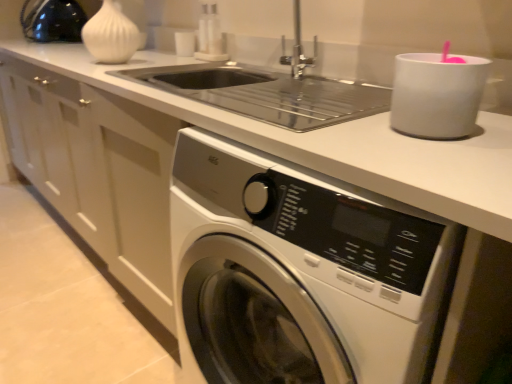
The width and height of the screenshot is (512, 384). What do you see at coordinates (300, 272) in the screenshot? I see `white glossy washing machine at lower center` at bounding box center [300, 272].

What do you see at coordinates (53, 21) in the screenshot? The image size is (512, 384). I see `matte black kettle at upper left, which ranks as the first appliance in left-to-right order` at bounding box center [53, 21].

At what (x,y) coordinates should I click in order to perform the action: click on white glossy washing machine at lower center. Please return your answer as a coordinate pair (x, y). The width and height of the screenshot is (512, 384). Looking at the image, I should click on (300, 272).

Is white matte cup at upper right, positioned as the second appliance in back-to-front order, at the back of matte black kettle at upper left, which ranks as the first appliance in left-to-right order?

No, matte black kettle at upper left, which ranks as the first appliance in left-to-right order, is not facing away from white matte cup at upper right, positioned as the second appliance in back-to-front order.

From the image's perspective, which is above, matte black kettle at upper left, which appears as the first appliance when viewed from the top, or white matte cup at upper right, which is the 2th appliance from left to right?

matte black kettle at upper left, which appears as the first appliance when viewed from the top, appears higher in the image.

Is matte black kettle at upper left, which ranks as the first appliance in left-to-right order, situated inside white matte cup at upper right, which is counted as the 1th appliance, starting from the right, or outside?

matte black kettle at upper left, which ranks as the first appliance in left-to-right order, is located beyond the bounds of white matte cup at upper right, which is counted as the 1th appliance, starting from the right.

Considering the positions of points (83, 17) and (430, 61), is point (83, 17) closer to camera compared to point (430, 61)?

No, it is not.

Considering their positions, is white glossy washing machine at lower center located in front of or behind white matte cup at upper right, positioned as the second appliance in back-to-front order?

A: Visually, white glossy washing machine at lower center is located in front of white matte cup at upper right, positioned as the second appliance in back-to-front order.

Would you say white glossy washing machine at lower center is inside or outside white matte cup at upper right, positioned as the second appliance in back-to-front order?

white glossy washing machine at lower center is spatially situated outside white matte cup at upper right, positioned as the second appliance in back-to-front order.

Which is in front, point (409, 252) or point (408, 76)?

The point (409, 252) is more forward.

I want to click on appliance that is the 1st one when counting upward from the white glossy washing machine at lower center (from the image's perspective), so click(x=437, y=94).

In the scene shown: Could white matte vase at upper left be considered to be inside matte black kettle at upper left, which appears as the 1th appliance when viewed from the back?

No, matte black kettle at upper left, which appears as the 1th appliance when viewed from the back, does not contain white matte vase at upper left.

Could you tell me if matte black kettle at upper left, which ranks as the first appliance in left-to-right order, is facing white matte vase at upper left?

No, matte black kettle at upper left, which ranks as the first appliance in left-to-right order, is not aimed at white matte vase at upper left.

From the image's perspective, which is below, matte black kettle at upper left, acting as the 2th appliance starting from the bottom, or white matte vase at upper left?

white matte vase at upper left appears lower in the image.

Can you confirm if matte black kettle at upper left, which is the second appliance from front to back, is taller than white matte vase at upper left?

Indeed, matte black kettle at upper left, which is the second appliance from front to back, has a greater height compared to white matte vase at upper left.

From a real-world perspective, is white matte vase at upper left above or below matte black kettle at upper left, which appears as the 1th appliance when viewed from the back?

white matte vase at upper left is below matte black kettle at upper left, which appears as the 1th appliance when viewed from the back.

Considering the sizes of white matte vase at upper left and matte black kettle at upper left, which appears as the 1th appliance when viewed from the back, in the image, is white matte vase at upper left bigger or smaller than matte black kettle at upper left, which appears as the 1th appliance when viewed from the back,?

In the image, white matte vase at upper left appears to be smaller than matte black kettle at upper left, which appears as the 1th appliance when viewed from the back.

Is white matte vase at upper left turned away from matte black kettle at upper left, which ranks as the first appliance in left-to-right order?

No.

From the image's perspective, which is above, white matte vase at upper left or matte black kettle at upper left, which is the second appliance from front to back?

From the image's view, matte black kettle at upper left, which is the second appliance from front to back, is above.

Is white glossy washing machine at lower center placed right next to white matte vase at upper left?

No, white glossy washing machine at lower center is not in contact with white matte vase at upper left.

Which is nearer, [205,195] or [116,51]?

Point [205,195] is positioned closer to the camera compared to point [116,51].

Would you say white glossy washing machine at lower center contains white matte vase at upper left?

No.

Measure the distance between white glossy washing machine at lower center and white matte vase at upper left.

The distance of white glossy washing machine at lower center from white matte vase at upper left is 3.35 feet.

Considering the sizes of objects white matte vase at upper left and white glossy washing machine at lower center in the image provided, who is taller, white matte vase at upper left or white glossy washing machine at lower center?

white glossy washing machine at lower center is taller.

This screenshot has width=512, height=384. Find the location of `washing machine lying below the white matte vase at upper left (from the image's perspective)`. washing machine lying below the white matte vase at upper left (from the image's perspective) is located at coordinates (300, 272).

Is white matte vase at upper left closer to the viewer compared to white glossy washing machine at lower center?

No, white matte vase at upper left is further to the viewer.

What's the angular difference between white matte vase at upper left and white glossy washing machine at lower center's facing directions?

The facing directions of white matte vase at upper left and white glossy washing machine at lower center are 0.571 degrees apart.

From a real-world perspective, is white matte vase at upper left physically located above or below white matte cup at upper right, which is the 2th appliance from left to right?

white matte vase at upper left is above white matte cup at upper right, which is the 2th appliance from left to right.

From the image's perspective, which is above, white matte vase at upper left or white matte cup at upper right, which is the 2th appliance from left to right?

white matte vase at upper left is shown above in the image.

Looking at their sizes, would you say white matte vase at upper left is wider or thinner than white matte cup at upper right, which is counted as the 1th appliance, starting from the right?

Considering their sizes, white matte vase at upper left looks broader than white matte cup at upper right, which is counted as the 1th appliance, starting from the right.

Is white matte vase at upper left next to white matte cup at upper right, the first appliance from the front?

There is a gap between white matte vase at upper left and white matte cup at upper right, the first appliance from the front.

The height and width of the screenshot is (384, 512). In order to click on appliance located behind the white matte cup at upper right, which is counted as the 1th appliance, starting from the right in this screenshot , I will do `click(53, 21)`.

The height and width of the screenshot is (384, 512). Find the location of `appliance that is on the right side of white glossy washing machine at lower center`. appliance that is on the right side of white glossy washing machine at lower center is located at coordinates (437, 94).

Considering their positions, is matte black kettle at upper left, which is the second appliance from front to back, positioned closer to white matte vase at upper left than white glossy washing machine at lower center?

Among the two, matte black kettle at upper left, which is the second appliance from front to back, is located nearer to white matte vase at upper left.

Looking at the image, which one is located further to white matte cup at upper right, the first appliance in the bottom-to-top sequence, white glossy washing machine at lower center or white matte vase at upper left?

Among the two, white matte vase at upper left is located further to white matte cup at upper right, the first appliance in the bottom-to-top sequence.

Looking at this image, when comparing their distances from matte black kettle at upper left, acting as the 2th appliance starting from the bottom, does white matte cup at upper right, which is counted as the 1th appliance, starting from the right, or white matte vase at upper left seem further?

Based on the image, white matte cup at upper right, which is counted as the 1th appliance, starting from the right, appears to be further to matte black kettle at upper left, acting as the 2th appliance starting from the bottom.

From the image, which object appears to be nearer to white matte cup at upper right, the first appliance from the front, white matte vase at upper left or matte black kettle at upper left, acting as the 2th appliance starting from the bottom?

white matte vase at upper left is positioned closer to the anchor white matte cup at upper right, the first appliance from the front.

Estimate the real-world distances between objects in this image. Which object is further from white matte vase at upper left, white glossy washing machine at lower center or white matte cup at upper right, which is counted as the 1th appliance, starting from the right?

white matte cup at upper right, which is counted as the 1th appliance, starting from the right.

Based on their spatial positions, is white glossy washing machine at lower center or white matte vase at upper left closer to matte black kettle at upper left, acting as the 2th appliance starting from the bottom?

white matte vase at upper left is closer to matte black kettle at upper left, acting as the 2th appliance starting from the bottom.

Based on their spatial positions, is white matte cup at upper right, which is counted as the 1th appliance, starting from the right, or matte black kettle at upper left, which appears as the first appliance when viewed from the top, closer to white matte vase at upper left?

Based on the image, matte black kettle at upper left, which appears as the first appliance when viewed from the top, appears to be nearer to white matte vase at upper left.

Which object lies further to the anchor point white glossy washing machine at lower center, matte black kettle at upper left, which appears as the 1th appliance when viewed from the back, or white matte cup at upper right, which is the 2th appliance from left to right?

Among the two, matte black kettle at upper left, which appears as the 1th appliance when viewed from the back, is located further to white glossy washing machine at lower center.

At what (x,y) coordinates should I click in order to perform the action: click on appliance between white glossy washing machine at lower center and matte black kettle at upper left, the second appliance from the right, in the front-back direction. Please return your answer as a coordinate pair (x, y). Image resolution: width=512 pixels, height=384 pixels. Looking at the image, I should click on pos(437,94).

You are a GUI agent. You are given a task and a screenshot of the screen. Output one action in this format:
    pyautogui.click(x=<x>, y=<y>)
    Task: Click on the vase between white glossy washing machine at lower center and matte black kettle at upper left, the second appliance from the right, along the z-axis
    The image size is (512, 384).
    Given the screenshot: What is the action you would take?
    pyautogui.click(x=110, y=35)

Where is `appliance between white glossy washing machine at lower center and white matte vase at upper left in the front-back direction`? The height and width of the screenshot is (384, 512). appliance between white glossy washing machine at lower center and white matte vase at upper left in the front-back direction is located at coordinates (437, 94).

I want to click on vase located between white matte cup at upper right, the first appliance in the bottom-to-top sequence, and matte black kettle at upper left, which is the second appliance from front to back, in the depth direction, so click(110, 35).